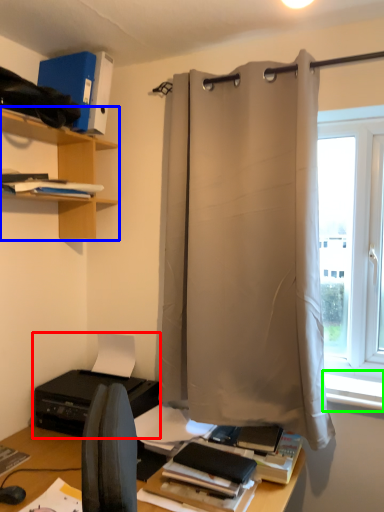
Question: Which object is positioned farthest from printer (highlighted by a red box)? Select from shelf (highlighted by a blue box) and window sill (highlighted by a green box).

Choices:
 (A) shelf
 (B) window sill

Answer: (B)